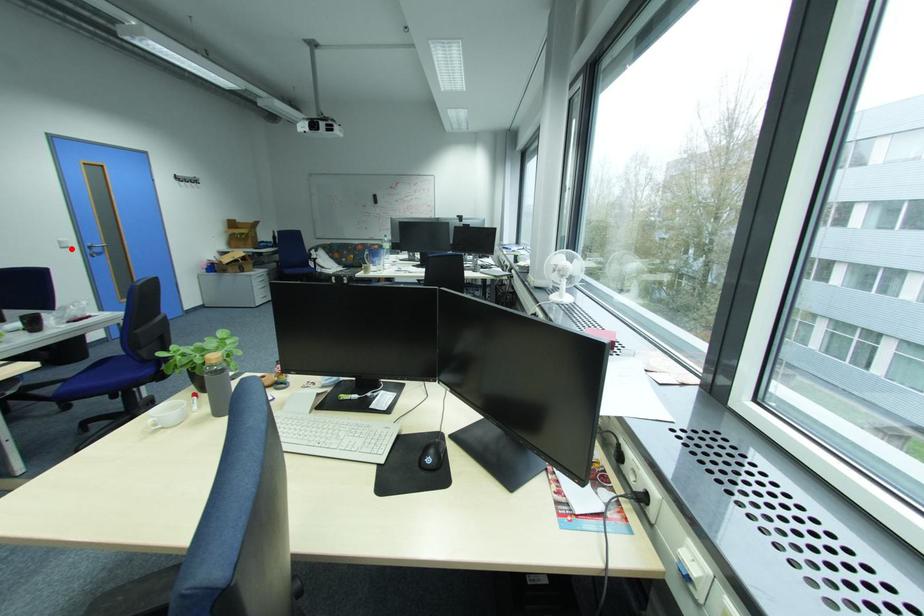
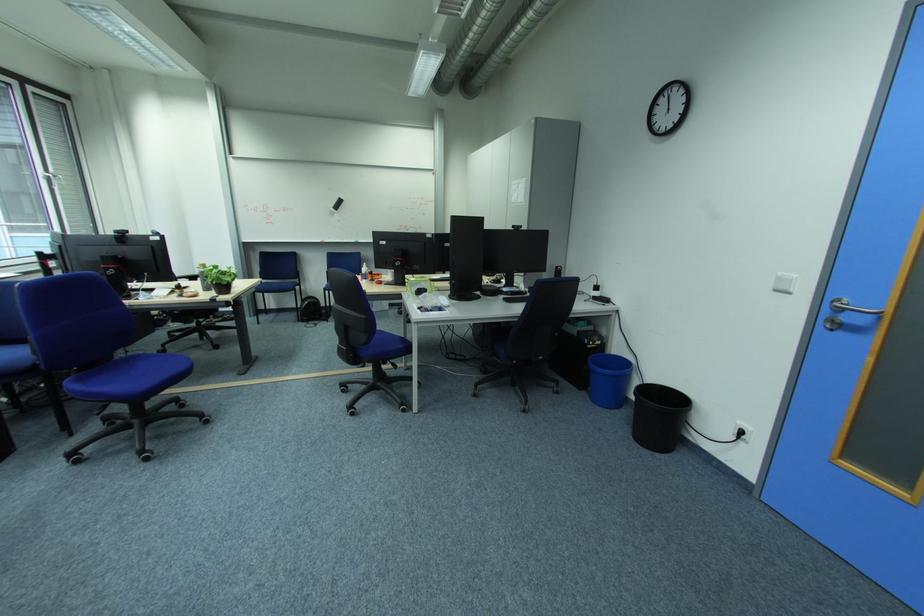
Question: I am providing you with two images of the same scene from different viewpoints. Given a red point in image1, look at the same physical point in image2. Is it:

Choices:
 (A) Closer to the viewpoint
 (B) Farther from the viewpoint

Answer: (A)